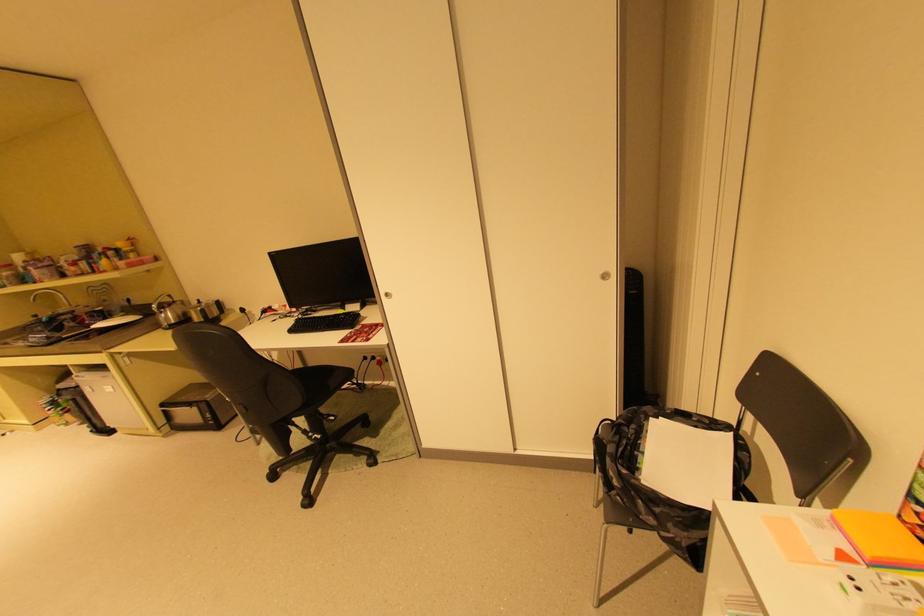
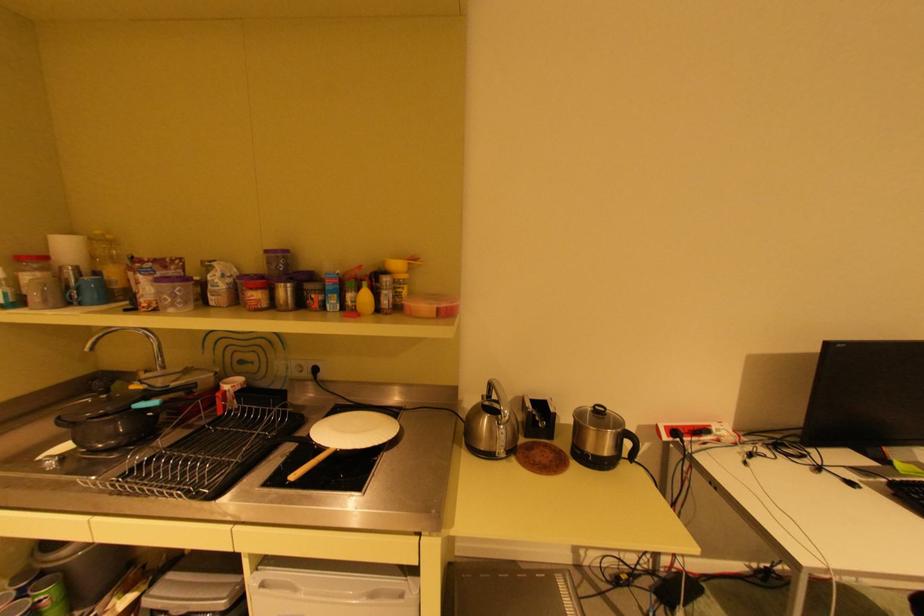
The point at (83, 246) is marked in the first image. Where is the corresponding point in the second image?

(274, 251)